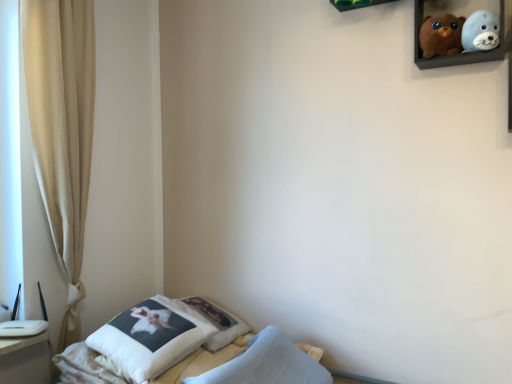
Question: Is the position of wooden shelf at upper center more distant than that of white cotton pillow at lower center, marked as the second pillow in a front-to-back arrangement?

Choices:
 (A) no
 (B) yes

Answer: (A)

Question: Considering the relative sizes of wooden shelf at upper center and white cotton pillow at lower center, which appears as the first pillow when viewed from the back, in the image provided, is wooden shelf at upper center bigger than white cotton pillow at lower center, which appears as the first pillow when viewed from the back,?

Choices:
 (A) no
 (B) yes

Answer: (A)

Question: Is wooden shelf at upper center looking in the opposite direction of white cotton pillow at lower center, marked as the second pillow in a front-to-back arrangement?

Choices:
 (A) no
 (B) yes

Answer: (A)

Question: Does wooden shelf at upper center appear on the right side of white cotton pillow at lower center, marked as the second pillow in a front-to-back arrangement?

Choices:
 (A) no
 (B) yes

Answer: (B)

Question: From the image's perspective, does wooden shelf at upper center appear higher than white cotton pillow at lower center, marked as the second pillow in a front-to-back arrangement?

Choices:
 (A) yes
 (B) no

Answer: (A)

Question: From the image's perspective, is wooden shelf at upper center under white cotton pillow at lower center, which appears as the first pillow when viewed from the back?

Choices:
 (A) yes
 (B) no

Answer: (B)

Question: Can you confirm if velvet plush toys at upper right is thinner than transparent glass window at left?

Choices:
 (A) no
 (B) yes

Answer: (B)

Question: Is the position of velvet plush toys at upper right more distant than that of transparent glass window at left?

Choices:
 (A) no
 (B) yes

Answer: (A)

Question: Does velvet plush toys at upper right come in front of transparent glass window at left?

Choices:
 (A) yes
 (B) no

Answer: (A)

Question: Is velvet plush toys at upper right aimed at transparent glass window at left?

Choices:
 (A) yes
 (B) no

Answer: (B)

Question: Is velvet plush toys at upper right next to transparent glass window at left?

Choices:
 (A) yes
 (B) no

Answer: (B)

Question: Is velvet plush toys at upper right facing away from transparent glass window at left?

Choices:
 (A) no
 (B) yes

Answer: (A)

Question: Is brown plush bear at upper right, the 1th toy in the left-to-right sequence, positioned beyond the bounds of white soft pillow at lower left, the first pillow from the front?

Choices:
 (A) yes
 (B) no

Answer: (A)